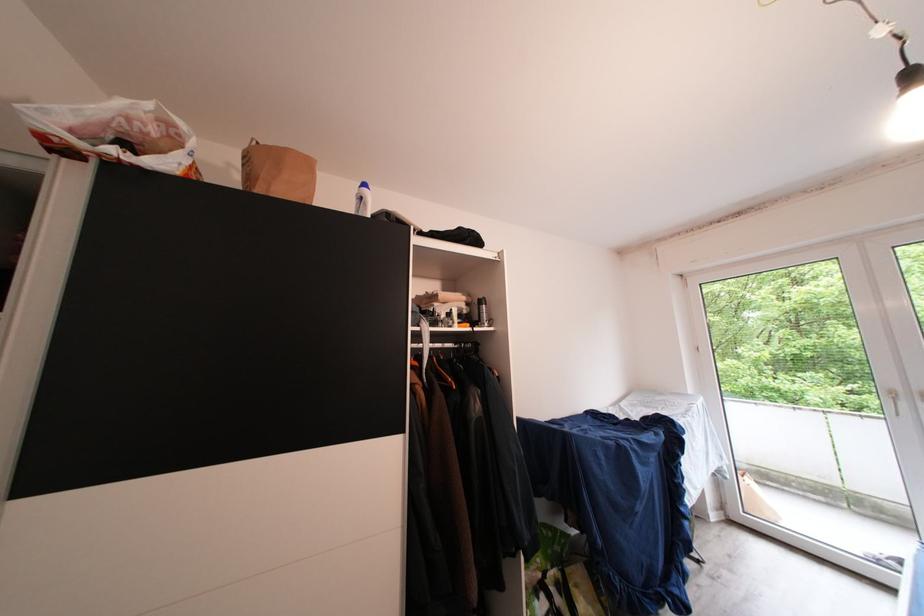
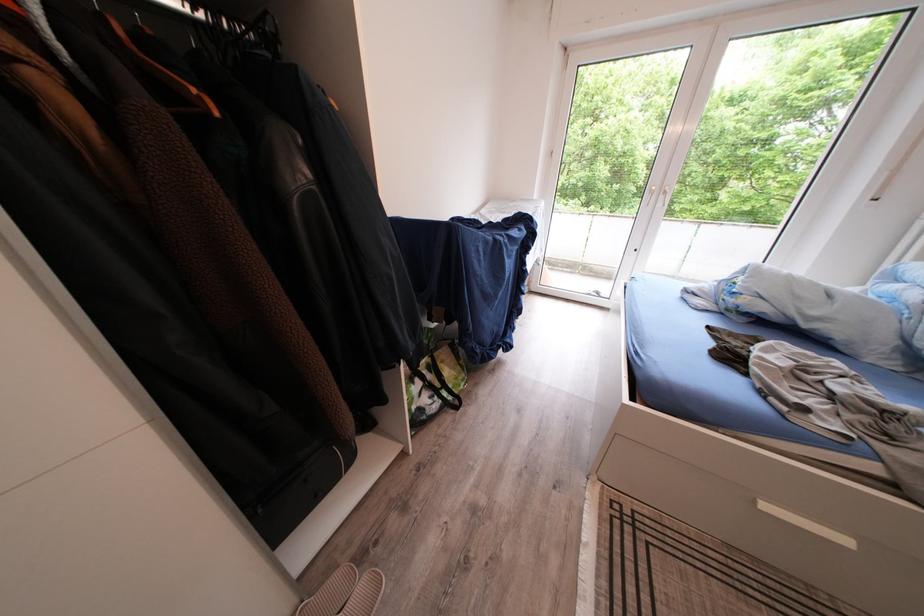
The first image is from the beginning of the video and the second image is from the end. How did the camera likely rotate when shooting the video?

The camera's rotation is toward right-down.